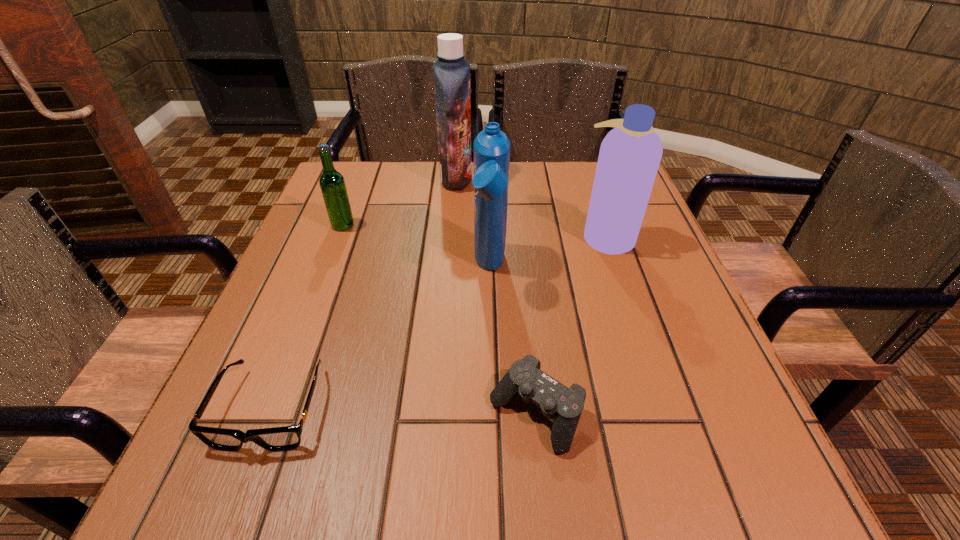
At what (x,y) coordinates should I click in order to perform the action: click on vacant area that lies between the rightmost object and the sunglasses. Please return your answer as a coordinate pair (x, y). This screenshot has height=540, width=960. Looking at the image, I should click on (439, 322).

At what (x,y) coordinates should I click in order to perform the action: click on vacant space in between the fifth tallest object and the third object from left to right. Please return your answer as a coordinate pair (x, y). Looking at the image, I should click on (496, 296).

This screenshot has width=960, height=540. I want to click on free spot between the beer bottle and the sunglasses, so click(x=307, y=317).

This screenshot has width=960, height=540. I want to click on the closest object relative to the fourth tallest object, so click(451, 72).

This screenshot has width=960, height=540. Find the location of `object that ranks as the second closest to the farthest object`. object that ranks as the second closest to the farthest object is located at coordinates (332, 184).

Select which shampoo appears as the second closest to the farthest object. Please provide its 2D coordinates. Your answer should be formatted as a tuple, i.e. [(x, y)], where the tuple contains the x and y coordinates of a point satisfying the conditions above.

[(630, 154)]

Identify the location of shampoo identified as the second closest to the shortest object. The height and width of the screenshot is (540, 960). (630, 154).

The height and width of the screenshot is (540, 960). I want to click on free location that satisfies the following two spatial constraints: 1. on the front label of the farthest shampoo; 2. on the front-facing side of the shortest object, so click(439, 408).

I want to click on vacant region that satisfies the following two spatial constraints: 1. on the front label of the leftmost shampoo; 2. on the left side of the second shampoo from left to right, so 449,268.

The image size is (960, 540). I want to click on vacant area in the image that satisfies the following two spatial constraints: 1. on the back side of the second shampoo from left to right; 2. on the front label of the farthest shampoo, so click(x=488, y=178).